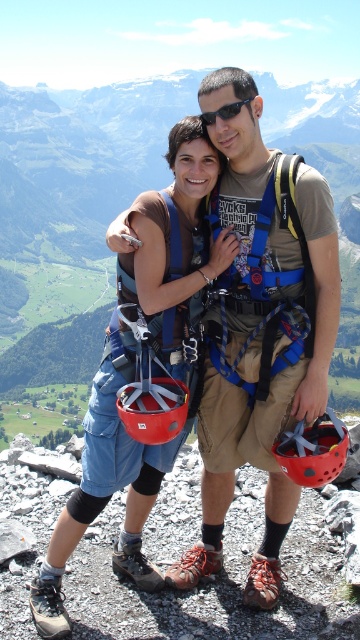
Question: Considering the real-world distances, which object is farthest from the matte red helmet at center?

Choices:
 (A) matte orange helmet at center
 (B) black plastic sunglasses at center

Answer: (B)

Question: Which object is positioned farthest from the matte orange helmet at center?

Choices:
 (A) black plastic sunglasses at center
 (B) matte red helmet at center

Answer: (A)

Question: Is matte red helmet at center positioned at the back of black plastic sunglasses at center?

Choices:
 (A) no
 (B) yes

Answer: (A)

Question: Can you confirm if matte orange helmet at center is smaller than matte red helmet at center?

Choices:
 (A) no
 (B) yes

Answer: (A)

Question: Where is matte orange helmet at center located in relation to matte red helmet at center in the image?

Choices:
 (A) left
 (B) right

Answer: (B)

Question: Which point is closer to the camera?

Choices:
 (A) matte orange helmet at center
 (B) matte red helmet at center
 (C) black plastic sunglasses at center

Answer: (A)